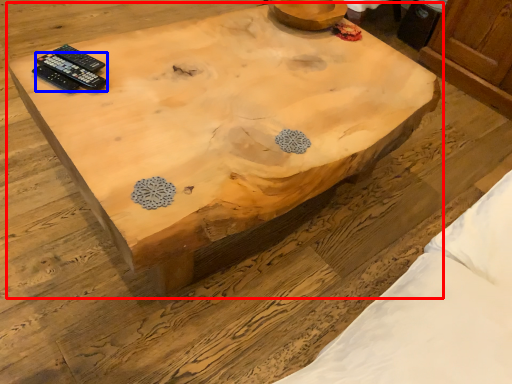
Question: Which of the following is the farthest to the observer, coffee table (highlighted by a red box) or remote control (highlighted by a blue box)?

Choices:
 (A) coffee table
 (B) remote control

Answer: (B)